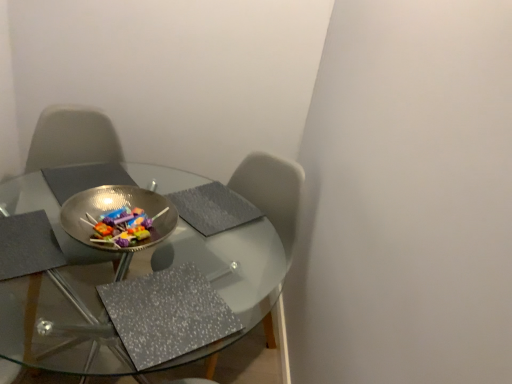
Question: From their relative heights in the image, would you say metallic reflective bowl at center is taller or shorter than transparent glass table at center?

Choices:
 (A) tall
 (B) short

Answer: (B)

Question: Is metallic reflective bowl at center wider or thinner than transparent glass table at center?

Choices:
 (A) wide
 (B) thin

Answer: (B)

Question: Visually, is metallic reflective bowl at center positioned to the left or to the right of transparent glass table at center?

Choices:
 (A) left
 (B) right

Answer: (B)

Question: In terms of size, does transparent glass table at center appear bigger or smaller than metallic reflective bowl at center?

Choices:
 (A) small
 (B) big

Answer: (B)

Question: Choose the correct answer: Is transparent glass table at center inside metallic reflective bowl at center or outside it?

Choices:
 (A) inside
 (B) outside

Answer: (B)

Question: In terms of height, does transparent glass table at center look taller or shorter compared to metallic reflective bowl at center?

Choices:
 (A) short
 (B) tall

Answer: (B)

Question: Considering the positions of point (260, 238) and point (173, 223), is point (260, 238) closer or farther from the camera than point (173, 223)?

Choices:
 (A) closer
 (B) farther

Answer: (B)